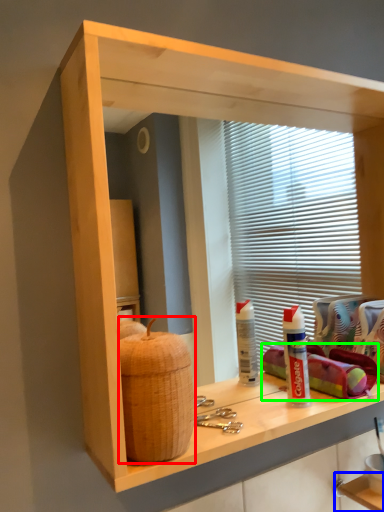
Question: Estimate the real-world distances between objects in this image. Which object is closer to basket (highlighted by a red box), shelf (highlighted by a blue box) or material (highlighted by a green box)?

Choices:
 (A) shelf
 (B) material

Answer: (B)